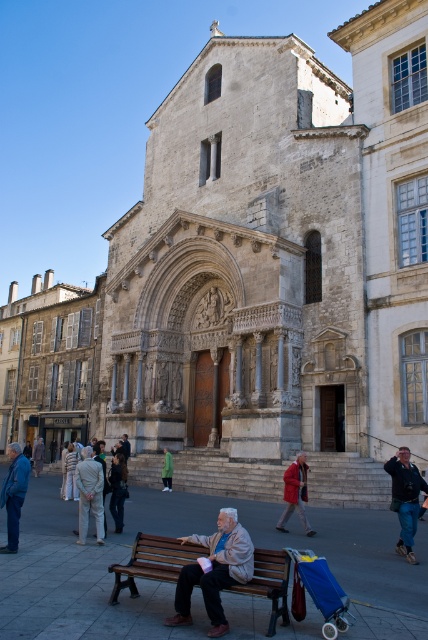
Question: Estimate the real-world distances between objects in this image. Which object is closer to the light brown leather jacket at lower left?

Choices:
 (A) light beige coat at lower left
 (B) light beige suit at lower left
 (C) light brown leather jacket at lower center

Answer: (B)

Question: Can you confirm if brown wooden bench at lower center is positioned below dark gray jacket at center?

Choices:
 (A) no
 (B) yes

Answer: (A)

Question: Which point is farther to the camera?

Choices:
 (A) (41, 438)
 (B) (318, 600)
 (C) (169, 486)
 (D) (89, 454)

Answer: (A)

Question: Observing the image, what is the correct spatial positioning of brown wooden bench at lower center in reference to light brown leather jacket at lower left?

Choices:
 (A) right
 (B) left

Answer: (A)

Question: Based on their relative distances, which object is nearer to the brown wooden bench at lower center?

Choices:
 (A) light beige coat at lower left
 (B) blue fabric stroller at lower right
 (C) light brown leather jacket at lower left
 (D) matte red coat at center

Answer: (B)

Question: In this image, where is light brown leather jacket at lower center located relative to light brown leather jacket at lower left?

Choices:
 (A) below
 (B) above

Answer: (B)